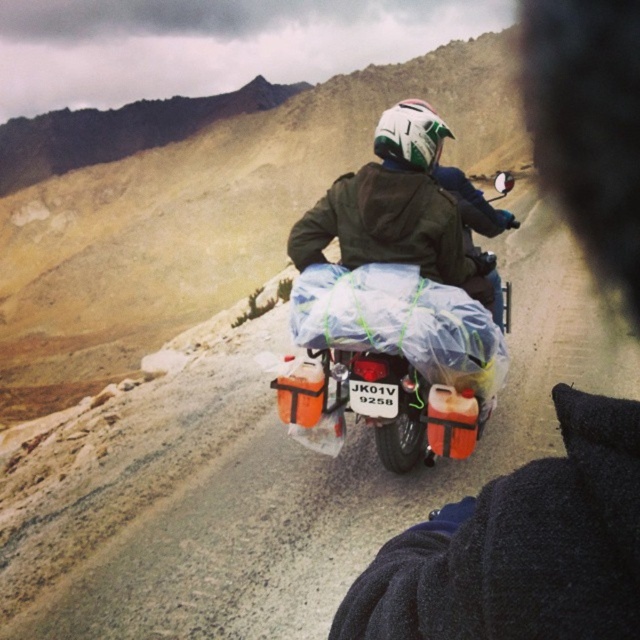
Question: Can you confirm if matte black jacket at center is wider than matte orange plastic motorcycle at center?

Choices:
 (A) no
 (B) yes

Answer: (B)

Question: Does matte black jacket at center have a greater width compared to matte orange plastic motorcycle at center?

Choices:
 (A) yes
 (B) no

Answer: (A)

Question: Is matte black jacket at center further to the viewer compared to matte orange plastic motorcycle at center?

Choices:
 (A) yes
 (B) no

Answer: (B)

Question: Among these points, which one is farthest from the camera?

Choices:
 (A) (554, 548)
 (B) (339, 208)

Answer: (B)

Question: Which point appears farthest from the camera in this image?

Choices:
 (A) (392, 612)
 (B) (304, 260)

Answer: (B)